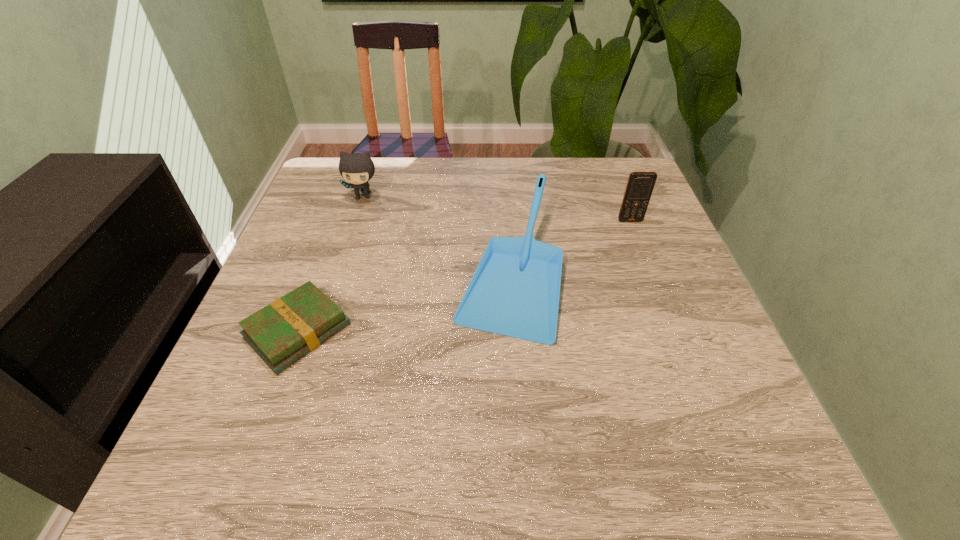
Where is `book present at the left edge`? book present at the left edge is located at coordinates (281, 333).

Find the location of a particular element. This screenshot has height=540, width=960. object present at the right edge is located at coordinates (640, 185).

The height and width of the screenshot is (540, 960). What are the coordinates of `object located at the far left corner` in the screenshot? It's located at pyautogui.click(x=356, y=168).

This screenshot has width=960, height=540. Find the location of `vacant region at the far edge of the desktop`. vacant region at the far edge of the desktop is located at coordinates (444, 167).

Where is `vacant space at the near edge of the desktop`? This screenshot has width=960, height=540. vacant space at the near edge of the desktop is located at coordinates (660, 439).

The width and height of the screenshot is (960, 540). In the image, there is a desktop. Find the location of `free space at the left edge`. free space at the left edge is located at coordinates (336, 220).

In the image, there is a desktop. Where is `vacant space at the right edge`? vacant space at the right edge is located at coordinates (622, 272).

The width and height of the screenshot is (960, 540). In the image, there is a desktop. Find the location of `vacant space at the far left corner`. vacant space at the far left corner is located at coordinates (312, 198).

Find the location of a particular element. Image resolution: width=960 pixels, height=540 pixels. free space at the near left corner of the desktop is located at coordinates (230, 490).

The height and width of the screenshot is (540, 960). What are the coordinates of `free space at the far right corner` in the screenshot? It's located at (617, 172).